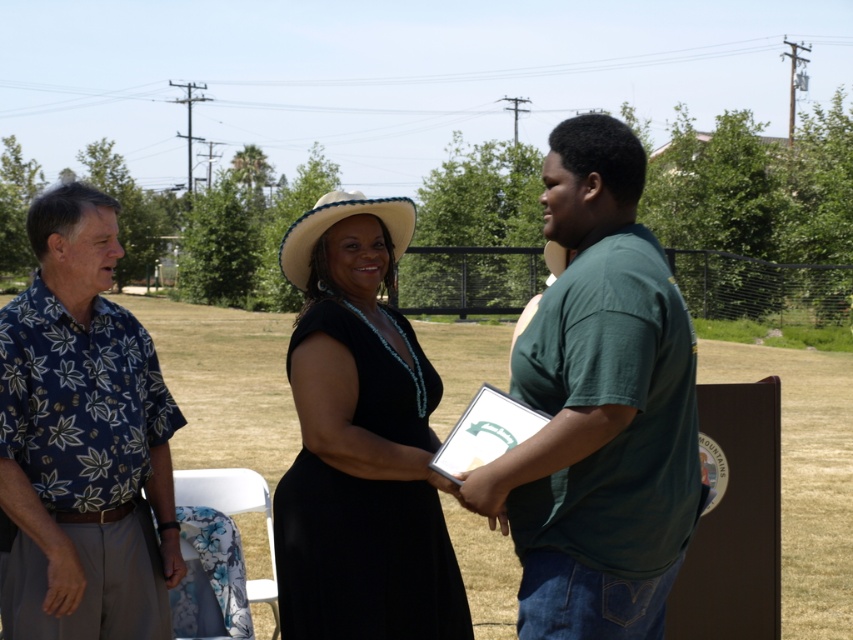
You are a photographer positioned to capture the interaction between the green matte shirt at center and the black matte dress at center. Which individual should you focus on to ensure their entire outfit fits within the frame if your camera has a limited width capacity?

The green matte shirt at center has a greater width than the black matte dress at center, so focusing on the green matte shirt at center ensures the entire outfit fits within the frame given the camera has limited width capacity.

You are a photographer at this event and need to capture a photo where both the blue floral shirt at left and the white straw cowboy hat at center are clearly visible. Considering their sizes, which object should you focus on to ensure both are in frame?

The blue floral shirt at left is bigger than the white straw cowboy hat at center, so focusing on the blue floral shirt at left would ensure both are in frame as it occupies more space.

You are a photographer at this event and need to ensure both the green matte shirt at center and the black matte dress at center are clearly visible in your photo. Given their sizes, which one might you need to frame more carefully to avoid being overshadowed?

The black matte dress at center is smaller in size than the green matte shirt at center, so you should frame the black matte dress at center more carefully to ensure it isn not overshadowed by the larger green matte shirt at center.